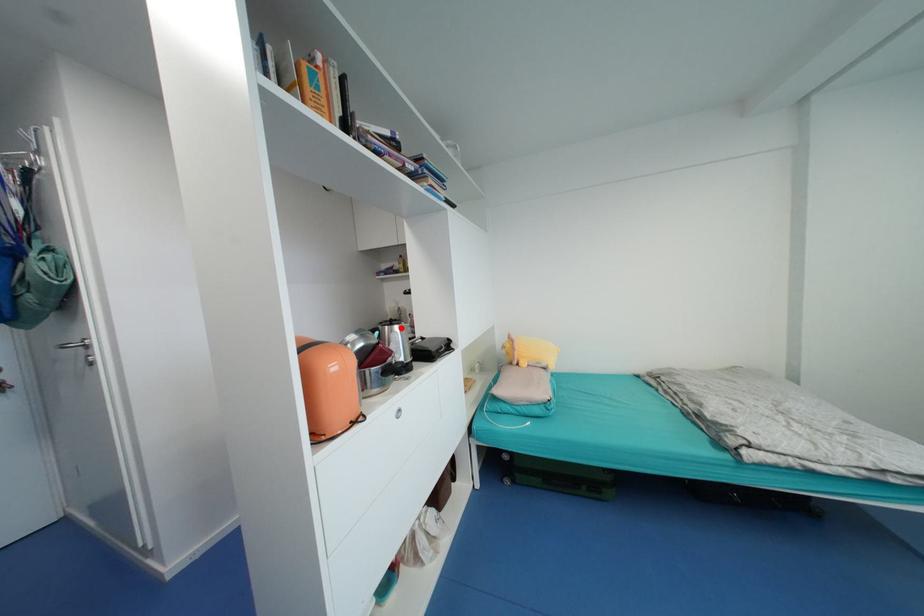
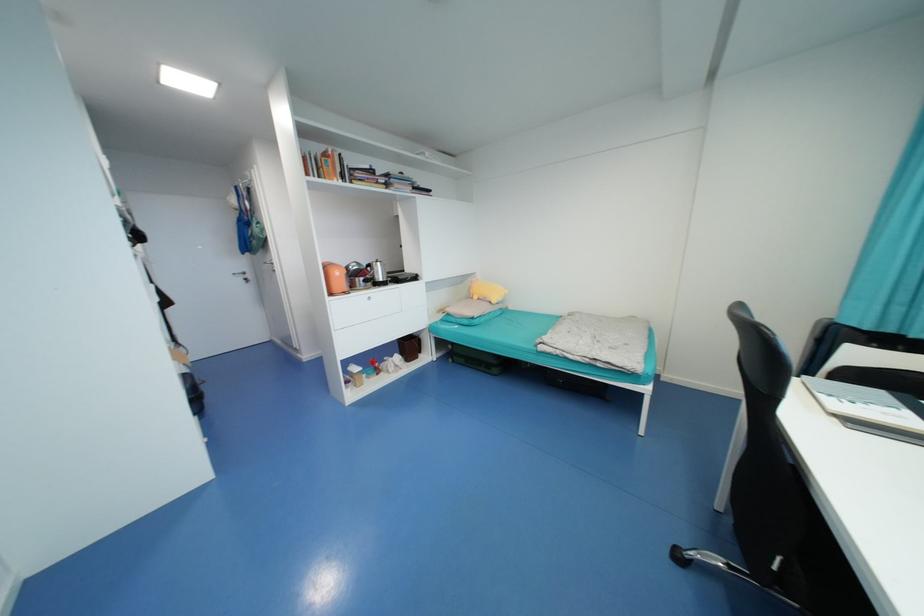
The point at the highlighted location is marked in the first image. Where is the corresponding point in the second image?

(383, 264)